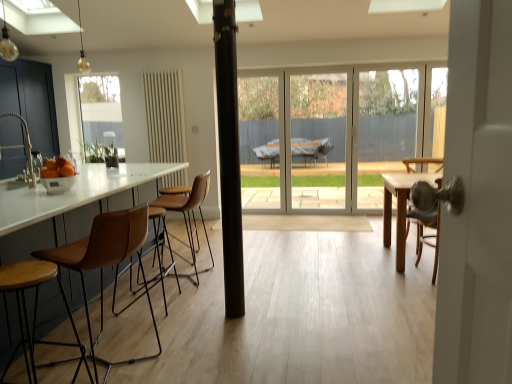
Locate an element on the screen. The width and height of the screenshot is (512, 384). vacant region to the right of brown leather stool at left is located at coordinates (202, 349).